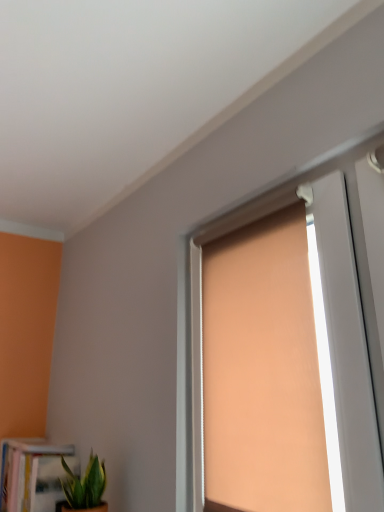
Question: Is green leafy plant at lower left oriented towards white glossy bookcase at lower left?

Choices:
 (A) no
 (B) yes

Answer: (A)

Question: Does green leafy plant at lower left have a greater height compared to white glossy bookcase at lower left?

Choices:
 (A) yes
 (B) no

Answer: (B)

Question: Is green leafy plant at lower left smaller than white glossy bookcase at lower left?

Choices:
 (A) no
 (B) yes

Answer: (B)

Question: From the image's perspective, is green leafy plant at lower left located above white glossy bookcase at lower left?

Choices:
 (A) no
 (B) yes

Answer: (B)

Question: From a real-world perspective, is green leafy plant at lower left on top of white glossy bookcase at lower left?

Choices:
 (A) yes
 (B) no

Answer: (B)

Question: Considering their positions, is matte orange roller blind at center located in front of or behind green leafy plant at lower left?

Choices:
 (A) behind
 (B) front

Answer: (B)

Question: In terms of height, does matte orange roller blind at center look taller or shorter compared to green leafy plant at lower left?

Choices:
 (A) tall
 (B) short

Answer: (A)

Question: Considering the positions of matte orange roller blind at center and green leafy plant at lower left in the image, is matte orange roller blind at center bigger or smaller than green leafy plant at lower left?

Choices:
 (A) big
 (B) small

Answer: (A)

Question: Is matte orange roller blind at center spatially inside green leafy plant at lower left, or outside of it?

Choices:
 (A) inside
 (B) outside

Answer: (B)

Question: Is point (64, 468) closer or farther from the camera than point (54, 454)?

Choices:
 (A) closer
 (B) farther

Answer: (A)

Question: From a real-world perspective, is green leafy plant at lower left positioned above or below white glossy bookcase at lower left?

Choices:
 (A) above
 (B) below

Answer: (B)

Question: Considering the positions of green leafy plant at lower left and white glossy bookcase at lower left in the image, is green leafy plant at lower left taller or shorter than white glossy bookcase at lower left?

Choices:
 (A) tall
 (B) short

Answer: (B)

Question: Considering the relative positions of green leafy plant at lower left and white glossy bookcase at lower left in the image provided, is green leafy plant at lower left to the left or to the right of white glossy bookcase at lower left?

Choices:
 (A) right
 (B) left

Answer: (A)

Question: Would you say white glossy bookcase at lower left is inside or outside green leafy plant at lower left?

Choices:
 (A) outside
 (B) inside

Answer: (A)

Question: In terms of height, does white glossy bookcase at lower left look taller or shorter compared to green leafy plant at lower left?

Choices:
 (A) tall
 (B) short

Answer: (A)